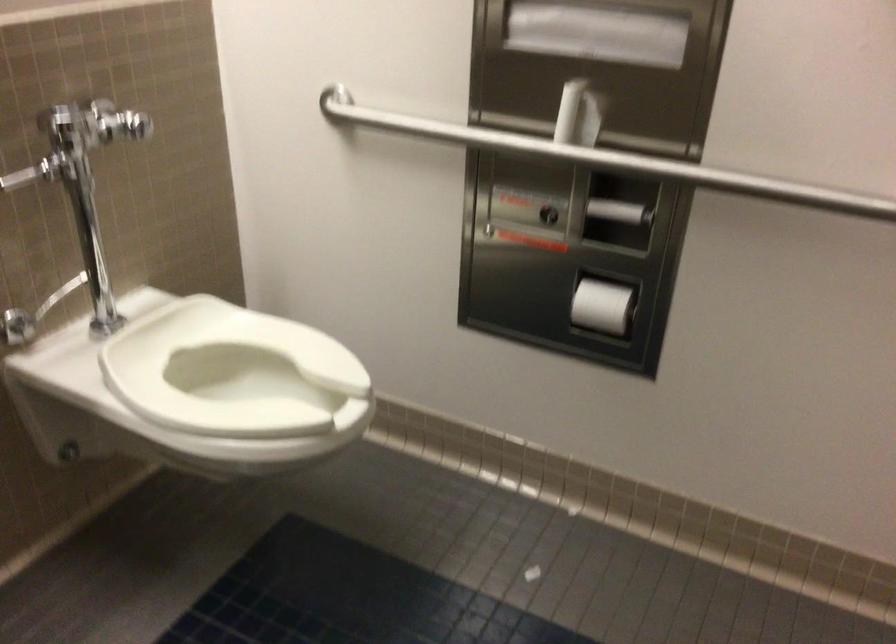
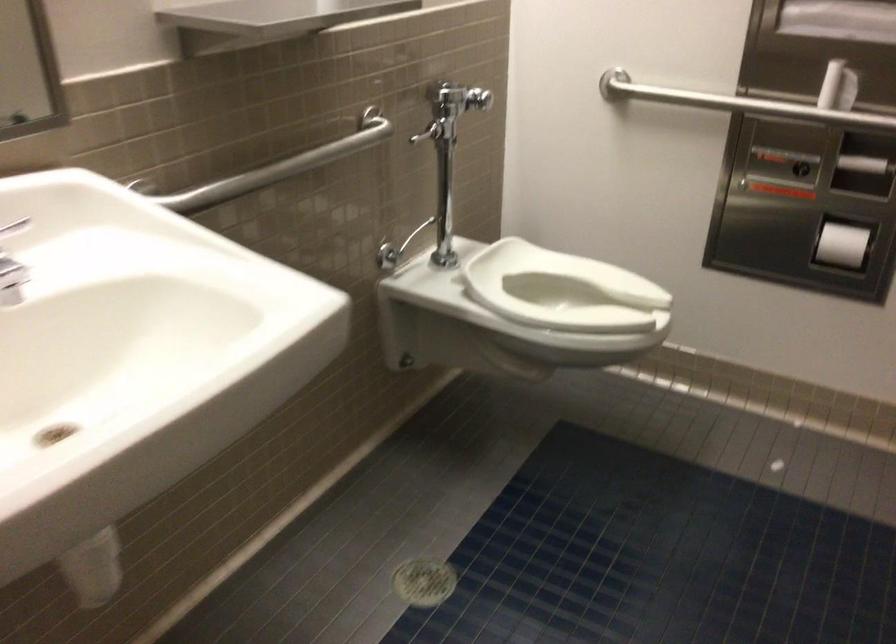
Locate, in the second image, the point that corresponds to [579,122] in the first image.

(838, 87)